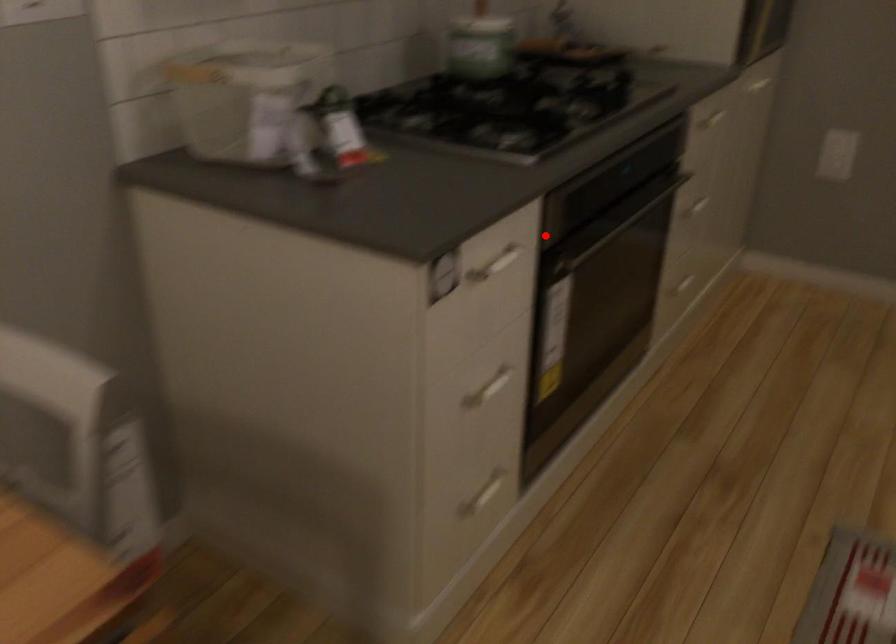
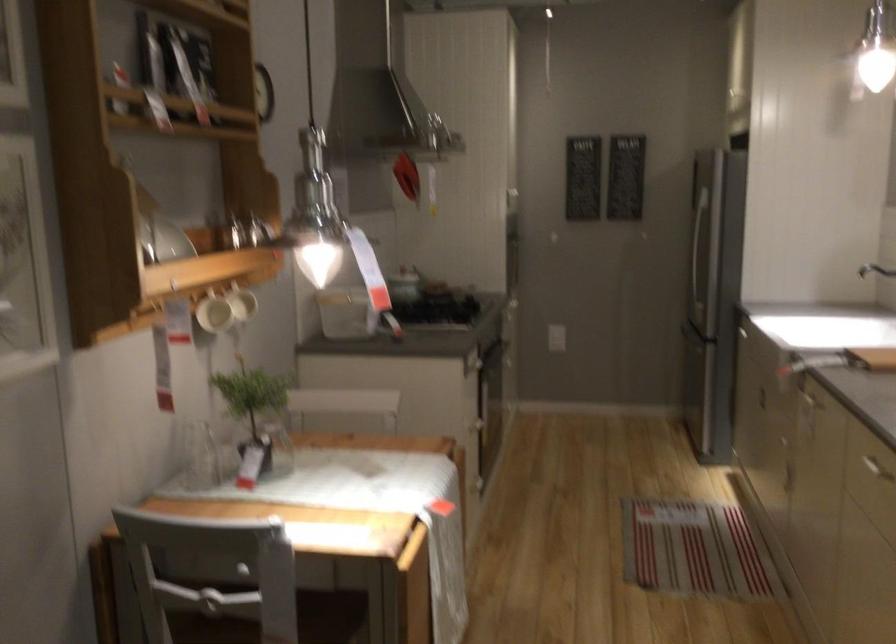
Where in the second image is the point corresponding to the highlighted location from the first image?

(489, 354)